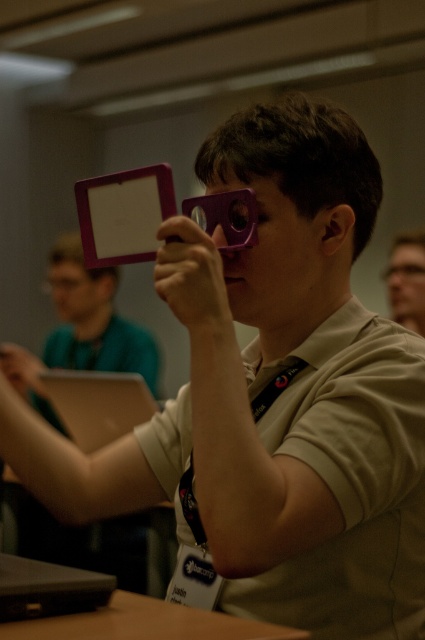
Can you confirm if matte black glasses at upper center is smaller than transparent plastic glasses at upper center?

Actually, matte black glasses at upper center might be larger than transparent plastic glasses at upper center.

Is matte black glasses at upper center below transparent plastic glasses at upper center?

Indeed, matte black glasses at upper center is positioned under transparent plastic glasses at upper center.

Does point (416, 252) lie behind point (408, 259)?

Yes, it is.

You are a GUI agent. You are given a task and a screenshot of the screen. Output one action in this format:
    pyautogui.click(x=<x>, y=<y>)
    Task: Click on the matte black glasses at upper center
    This screenshot has width=425, height=640.
    Given the screenshot: What is the action you would take?
    pyautogui.click(x=407, y=280)

Does pink matte tablet at upper center have a smaller size compared to transparent plastic glasses at upper center?

Yes, pink matte tablet at upper center is smaller than transparent plastic glasses at upper center.

Where is `pink matte tablet at upper center`? The width and height of the screenshot is (425, 640). pink matte tablet at upper center is located at coordinates (124, 214).

Locate an element on the screen. This screenshot has height=640, width=425. pink matte tablet at upper center is located at coordinates (124, 214).

At what (x,y) coordinates should I click in order to perform the action: click on pink matte tablet at upper center. Please return your answer as a coordinate pair (x, y). The image size is (425, 640). Looking at the image, I should click on (124, 214).